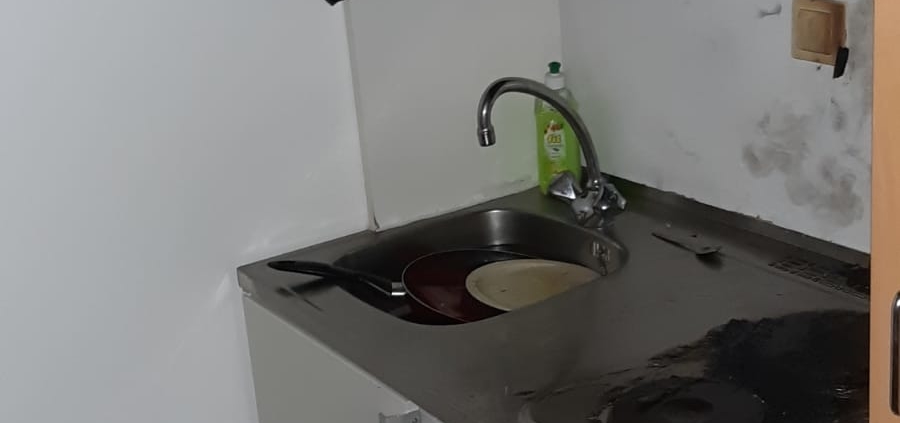
Identify the location of left handle (faucet). The width and height of the screenshot is (900, 423). (563, 191).